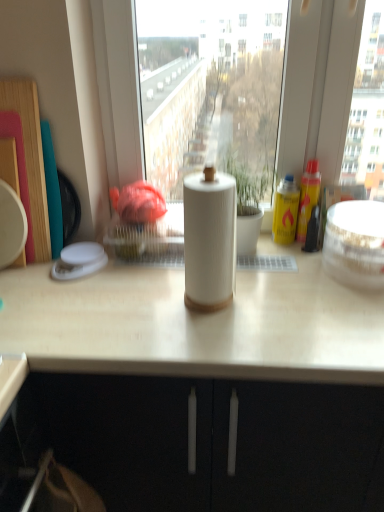
Image resolution: width=384 pixels, height=512 pixels. What are the coordinates of `vacant position to the left of white plastic container at left, the 2th appliance in the right-to-left sequence` in the screenshot? It's located at click(24, 271).